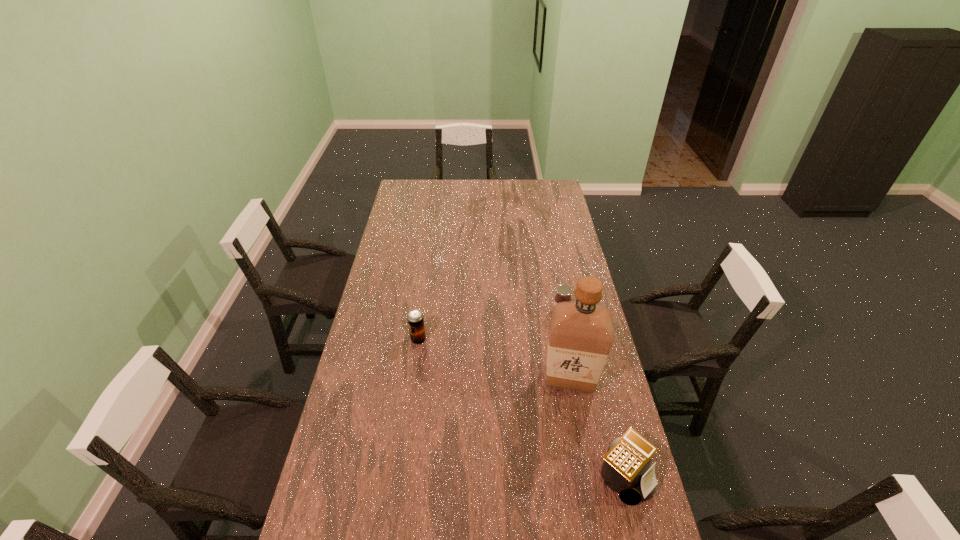
Where is `beer can`? The width and height of the screenshot is (960, 540). beer can is located at coordinates (415, 317).

Find the location of `the third nearest object`. the third nearest object is located at coordinates (415, 317).

Where is `calculator`? The image size is (960, 540). calculator is located at coordinates (625, 470).

Identify the location of the farthest object. This screenshot has width=960, height=540. (564, 291).

Locate an element on the screen. liquor is located at coordinates (581, 333).

Find the location of a particular element. This screenshot has height=540, width=960. the second nearest object is located at coordinates point(581,333).

Find the location of a particular element. This screenshot has width=960, height=540. vacant region located 0.320m on the right of the beer can is located at coordinates (511, 340).

Identify the location of vacant region located 0.260m on the back of the nearest object. The image size is (960, 540). (599, 378).

You are a GUI agent. You are given a task and a screenshot of the screen. Output one action in this format:
    pyautogui.click(x=<x>, y=<y>)
    Task: Click on the vacant region located 0.120m on the label side of the jam
    
    Given the screenshot: What is the action you would take?
    pyautogui.click(x=550, y=340)

Find the location of a particular element. The height and width of the screenshot is (540, 960). vacant area situated 0.380m on the label side of the jam is located at coordinates (529, 394).